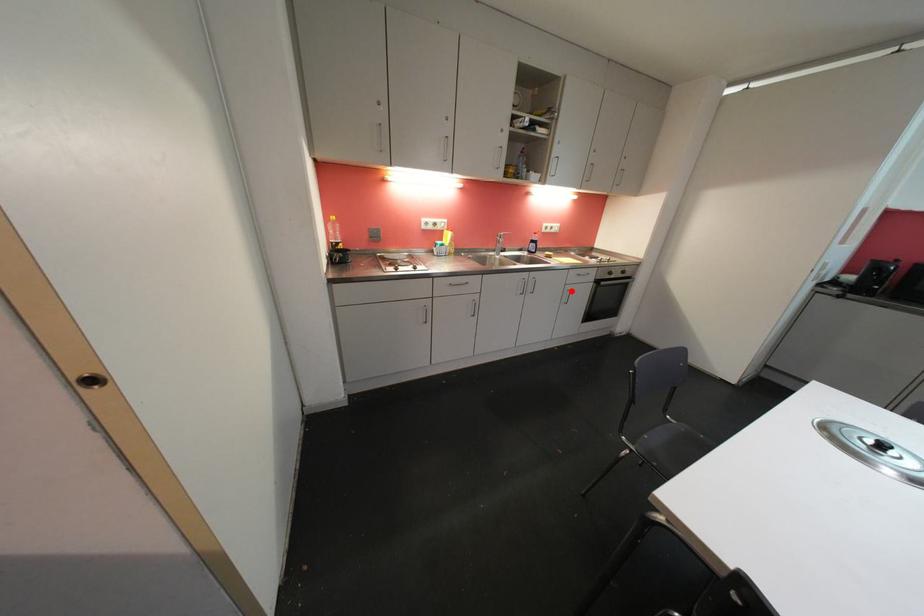
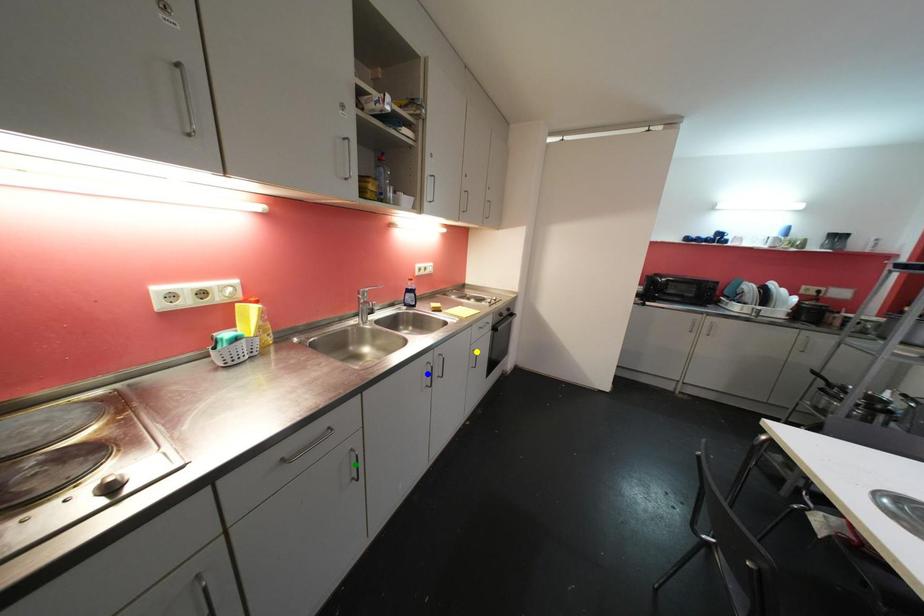
Question: I am providing you with two images of the same scene from different viewpoints. A red point is marked on the first image. You are given multiple points on the second image. Which mark in image 2 goes with the point in image 1?

Choices:
 (A) blue point
 (B) yellow point
 (C) green point

Answer: (B)